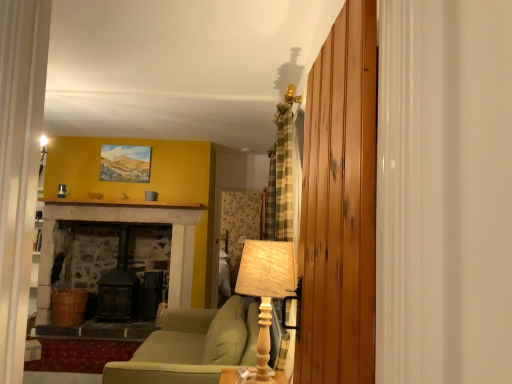
Describe the element at coordinates (192, 346) in the screenshot. The width and height of the screenshot is (512, 384). I see `green fabric couch at center` at that location.

I want to click on woven fabric lampshade at right, so click(266, 290).

Is wooden planks at right at the back of green fabric couch at center?

green fabric couch at center is not turned away from wooden planks at right.

Considering the positions of point (104, 383) and point (331, 252), is point (104, 383) closer or farther from the camera than point (331, 252)?

Point (104, 383).

Which is more to the right, green fabric couch at center or wooden planks at right?

wooden planks at right is more to the right.

Does matte oil painting at upper center have a smaller size compared to green fabric couch at center?

Yes.

From a real-world perspective, which is physically above, matte oil painting at upper center or green fabric couch at center?

matte oil painting at upper center, from a real-world perspective.

Are matte oil painting at upper center and green fabric couch at center beside each other?

They are not placed beside each other.

Based on the photo, considering the sizes of matte oil painting at upper center and green fabric couch at center in the image, is matte oil painting at upper center wider or thinner than green fabric couch at center?

In the image, matte oil painting at upper center appears to be more narrow than green fabric couch at center.

Considering the sizes of objects matte oil painting at upper center and wooden planks at right in the image provided, who is shorter, matte oil painting at upper center or wooden planks at right?

With less height is matte oil painting at upper center.

Can you confirm if matte oil painting at upper center is bigger than wooden planks at right?

No, matte oil painting at upper center is not bigger than wooden planks at right.

Between matte oil painting at upper center and wooden planks at right, which one is positioned in front?

Answer: wooden planks at right is more forward.

From the image's perspective, is matte oil painting at upper center located above or below wooden planks at right?

From the image's perspective, matte oil painting at upper center appears above wooden planks at right.

Looking at this image, is green fabric couch at center to the right of woven fabric lampshade at right from the viewer's perspective?

No, green fabric couch at center is not to the right of woven fabric lampshade at right.

Is green fabric couch at center facing towards woven fabric lampshade at right?

No, green fabric couch at center is not facing towards woven fabric lampshade at right.

Does green fabric couch at center touch woven fabric lampshade at right?

No, green fabric couch at center is not in contact with woven fabric lampshade at right.

Who is bigger, green fabric couch at center or woven fabric lampshade at right?

green fabric couch at center is bigger.

Considering the sizes of objects matte oil painting at upper center and woven fabric lampshade at right in the image provided, who is taller, matte oil painting at upper center or woven fabric lampshade at right?

woven fabric lampshade at right.

Is the depth of matte oil painting at upper center greater than that of woven fabric lampshade at right?

Yes, matte oil painting at upper center is behind woven fabric lampshade at right.

Considering the points (106, 180) and (259, 334), which point is behind, point (106, 180) or point (259, 334)?

The point (106, 180) is behind.

Is matte oil painting at upper center not inside woven fabric lampshade at right?

Yes.

Is wooden planks at right not close to woven fabric lampshade at right?

wooden planks at right is near woven fabric lampshade at right, not far away.

Considering the sizes of objects wooden planks at right and woven fabric lampshade at right in the image provided, who is thinner, wooden planks at right or woven fabric lampshade at right?

wooden planks at right is thinner.

Between wooden planks at right and woven fabric lampshade at right, which one has larger size?

Bigger between the two is wooden planks at right.

Is wooden planks at right further to the viewer compared to woven fabric lampshade at right?

No, it is not.

Is green fabric couch at center looking in the opposite direction of matte oil painting at upper center?

No, green fabric couch at center is not facing away from matte oil painting at upper center.

Can you confirm if green fabric couch at center is positioned to the right of matte oil painting at upper center?

Yes.

From the image's perspective, relative to matte oil painting at upper center, is green fabric couch at center above or below?

green fabric couch at center is below matte oil painting at upper center.

Are green fabric couch at center and matte oil painting at upper center far apart?

That's right, there is a large distance between green fabric couch at center and matte oil painting at upper center.

Find the location of a particular element. This screenshot has height=384, width=512. barn door above the green fabric couch at center (from the image's perspective) is located at coordinates (340, 205).

Where is `studio couch on the right of matte oil painting at upper center`? studio couch on the right of matte oil painting at upper center is located at coordinates (192, 346).

Which object lies further to the anchor point woven fabric lampshade at right, green fabric couch at center or wooden planks at right?

Among the two, wooden planks at right is located further to woven fabric lampshade at right.

Looking at the image, which one is located closer to wooden planks at right, matte oil painting at upper center or woven fabric lampshade at right?

Among the two, woven fabric lampshade at right is located nearer to wooden planks at right.

Considering their positions, is matte oil painting at upper center positioned closer to wooden planks at right than green fabric couch at center?

green fabric couch at center.

In the scene shown: From the image, which object appears to be nearer to wooden planks at right, woven fabric lampshade at right or green fabric couch at center?

The object closer to wooden planks at right is woven fabric lampshade at right.

Estimate the real-world distances between objects in this image. Which object is further from green fabric couch at center, woven fabric lampshade at right or matte oil painting at upper center?

matte oil painting at upper center is further to green fabric couch at center.

Estimate the real-world distances between objects in this image. Which object is further from woven fabric lampshade at right, green fabric couch at center or matte oil painting at upper center?

matte oil painting at upper center lies further to woven fabric lampshade at right than the other object.

From the image, which object appears to be farther from green fabric couch at center, matte oil painting at upper center or wooden planks at right?

Among the two, matte oil painting at upper center is located further to green fabric couch at center.

Based on their spatial positions, is wooden planks at right or woven fabric lampshade at right further from green fabric couch at center?

wooden planks at right is positioned further to the anchor green fabric couch at center.

Identify the location of table lamp between wooden planks at right and green fabric couch at center in the front-back direction. (266, 290).

Image resolution: width=512 pixels, height=384 pixels. Find the location of `studio couch between woven fabric lampshade at right and matte oil painting at upper center along the z-axis`. studio couch between woven fabric lampshade at right and matte oil painting at upper center along the z-axis is located at coordinates (192, 346).

Image resolution: width=512 pixels, height=384 pixels. I want to click on table lamp located between wooden planks at right and matte oil painting at upper center in the depth direction, so click(266, 290).

I want to click on studio couch between wooden planks at right and matte oil painting at upper center along the z-axis, so click(192, 346).